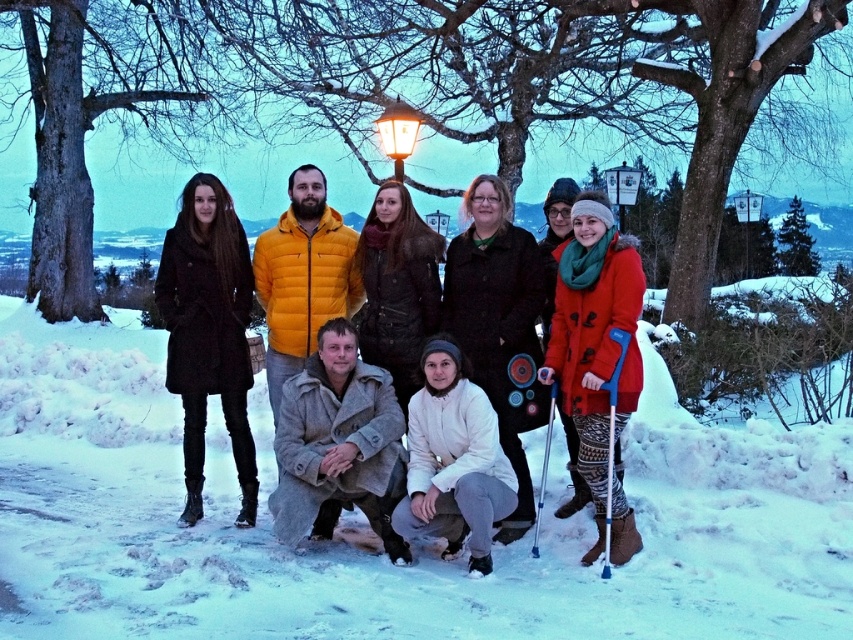
Does white fleece jacket at center appear on the right side of white fleece jacket at lower center?

Indeed, white fleece jacket at center is positioned on the right side of white fleece jacket at lower center.

Is white fleece jacket at center bigger than white fleece jacket at lower center?

Yes, white fleece jacket at center is bigger than white fleece jacket at lower center.

Which is behind, point (532, 404) or point (485, 472)?

The point (532, 404) is behind.

Identify the location of white fleece jacket at center. This screenshot has height=640, width=853. click(497, 321).

Is point (392, 388) more distant than point (526, 422)?

That is False.

Can you confirm if gray wool coat at center is positioned below white fleece jacket at center?

Yes, gray wool coat at center is below white fleece jacket at center.

The image size is (853, 640). Find the location of `gray wool coat at center`. gray wool coat at center is located at coordinates (338, 444).

Does matte black coat at left have a greater width compared to gray wool coat at center?

No, matte black coat at left is not wider than gray wool coat at center.

Consider the image. Is matte black coat at left thinner than gray wool coat at center?

Correct, matte black coat at left's width is less than gray wool coat at center's.

Identify the location of matte black coat at left. (207, 332).

You are a GUI agent. You are given a task and a screenshot of the screen. Output one action in this format:
    pyautogui.click(x=<x>, y=<y>)
    Task: Click on the matte black coat at left
    The height and width of the screenshot is (640, 853).
    Given the screenshot: What is the action you would take?
    pyautogui.click(x=207, y=332)